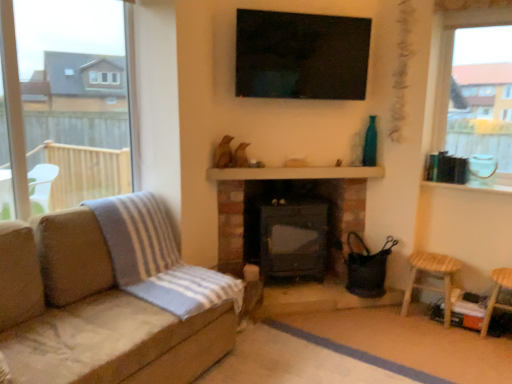
The width and height of the screenshot is (512, 384). What do you see at coordinates (294, 173) in the screenshot?
I see `wooden balustrade at center` at bounding box center [294, 173].

The width and height of the screenshot is (512, 384). In order to click on wooden stool at lower right, which is the first bar stool in left-to-right order in this screenshot , I will do `click(432, 277)`.

Looking at this image, measure the distance between point [429,266] and camera.

Point [429,266] is 9.53 feet away from camera.

What are the coordinates of `black glossy tv at upper center` in the screenshot? It's located at (301, 55).

Find the location of a particular element. The width and height of the screenshot is (512, 384). wooden stool at lower right, which ranks as the first bar stool in right-to-left order is located at coordinates (497, 295).

Where is `black matte fireplace at center`? This screenshot has width=512, height=384. black matte fireplace at center is located at coordinates (292, 205).

In the image, is clear glass window at upper right, which is counted as the 2th window, starting from the left, on the left side or the right side of black matte fireplace at center?

From the image, it's evident that clear glass window at upper right, which is counted as the 2th window, starting from the left, is to the right of black matte fireplace at center.

From a real-world perspective, does clear glass window at upper right, the first window positioned from the right, stand above black matte fireplace at center?

Yes, from a real-world perspective, clear glass window at upper right, the first window positioned from the right, is above black matte fireplace at center.

Is clear glass window at upper right, the first window positioned from the right, thinner than black matte fireplace at center?

Correct, the width of clear glass window at upper right, the first window positioned from the right, is less than that of black matte fireplace at center.

From the image's perspective, which is below, clear glass window at upper right, the first window positioned from the right, or black matte fireplace at center?

From the image's view, black matte fireplace at center is below.

Between suede couch at left and clear glass window at upper right, which is counted as the 2th window, starting from the left, which one appears on the left side from the viewer's perspective?

suede couch at left is more to the left.

From the image's perspective, is suede couch at left above clear glass window at upper right, which is counted as the 2th window, starting from the left?

No, from the image's perspective, suede couch at left is not above clear glass window at upper right, which is counted as the 2th window, starting from the left.

From a real-world perspective, starting from the suede couch at left, which window is the 2nd one vertically above it? Please provide its 2D coordinates.

[(449, 66)]

Is the position of wooden stool at lower right, which is counted as the second bar stool, starting from the right, less distant than that of transparent glass window at left, the 2th window positioned from the right?

No, it is behind transparent glass window at left, the 2th window positioned from the right.

Is wooden stool at lower right, which is the first bar stool in left-to-right order, not close to transparent glass window at left, the 2th window positioned from the right?

Yes, wooden stool at lower right, which is the first bar stool in left-to-right order, and transparent glass window at left, the 2th window positioned from the right, are quite far apart.

Considering the sizes of objects wooden stool at lower right, which is the first bar stool in left-to-right order, and transparent glass window at left, the 2th window positioned from the right, in the image provided, who is wider, wooden stool at lower right, which is the first bar stool in left-to-right order, or transparent glass window at left, the 2th window positioned from the right,?

wooden stool at lower right, which is the first bar stool in left-to-right order, is wider.

From the image's perspective, is wooden stool at lower right, which is counted as the second bar stool, starting from the right, above transparent glass window at left, marked as the first window in a left-to-right arrangement?

No.

Is wooden stool at lower right, which is counted as the second bar stool, starting from the right, oriented away from clear glass window at upper right, which is counted as the 2th window, starting from the left?

No, wooden stool at lower right, which is counted as the second bar stool, starting from the right,'s orientation is not away from clear glass window at upper right, which is counted as the 2th window, starting from the left.

Between wooden stool at lower right, which is the first bar stool in left-to-right order, and clear glass window at upper right, the first window positioned from the right, which one has smaller width?

clear glass window at upper right, the first window positioned from the right.

Consider the image. Is wooden stool at lower right, which is the first bar stool in left-to-right order, not near clear glass window at upper right, the first window positioned from the right?

That's right, there is a large distance between wooden stool at lower right, which is the first bar stool in left-to-right order, and clear glass window at upper right, the first window positioned from the right.

Which is correct: wooden stool at lower right, which is the first bar stool in left-to-right order, is inside clear glass window at upper right, which is counted as the 2th window, starting from the left, or outside of it?

wooden stool at lower right, which is the first bar stool in left-to-right order, cannot be found inside clear glass window at upper right, which is counted as the 2th window, starting from the left.

How different are the orientations of wooden stool at lower right, which is counted as the second bar stool, starting from the right, and suede couch at left in degrees?

The angle between the facing direction of wooden stool at lower right, which is counted as the second bar stool, starting from the right, and the facing direction of suede couch at left is 89.4 degrees.

From a real-world perspective, is wooden stool at lower right, which is the first bar stool in left-to-right order, on suede couch at left?

No.

Does wooden stool at lower right, which is the first bar stool in left-to-right order, have a lesser width compared to suede couch at left?

Correct, the width of wooden stool at lower right, which is the first bar stool in left-to-right order, is less than that of suede couch at left.

Is wooden stool at lower right, which is counted as the second bar stool, starting from the right, shorter than suede couch at left?

Yes, wooden stool at lower right, which is counted as the second bar stool, starting from the right, is shorter than suede couch at left.

From a real-world perspective, who is located higher, clear glass window at upper right, which is counted as the 2th window, starting from the left, or black glossy tv at upper center?

In real-world perspective, black glossy tv at upper center is above.

Measure the distance between clear glass window at upper right, the first window positioned from the right, and black glossy tv at upper center.

31.47 inches.

Which is nearer, (436, 138) or (269, 44)?

Point (436, 138) appears to be farther away from the viewer than point (269, 44).

Who is smaller, clear glass window at upper right, which is counted as the 2th window, starting from the left, or black glossy tv at upper center?

black glossy tv at upper center.

Is transparent glass window at left, the 2th window positioned from the right, not near wooden stool at lower right, which ranks as the first bar stool in right-to-left order?

Indeed, transparent glass window at left, the 2th window positioned from the right, is not near wooden stool at lower right, which ranks as the first bar stool in right-to-left order.

Based on their sizes in the image, would you say transparent glass window at left, marked as the first window in a left-to-right arrangement, is bigger or smaller than wooden stool at lower right, placed as the second bar stool when sorted from left to right?

In the image, transparent glass window at left, marked as the first window in a left-to-right arrangement, appears to be larger than wooden stool at lower right, placed as the second bar stool when sorted from left to right.

Can we say transparent glass window at left, marked as the first window in a left-to-right arrangement, lies outside wooden stool at lower right, placed as the second bar stool when sorted from left to right?

transparent glass window at left, marked as the first window in a left-to-right arrangement, lies outside wooden stool at lower right, placed as the second bar stool when sorted from left to right,'s area.

What are the coordinates of `fireplace located behind the clear glass window at upper right, which is counted as the 2th window, starting from the left` in the screenshot? It's located at (292, 205).

The image size is (512, 384). Identify the location of window to the right of suede couch at left. [449, 66].

Which object lies nearer to the anchor point black glossy tv at upper center, suede couch at left or clear glass window at upper right, which is counted as the 2th window, starting from the left?

Among the two, clear glass window at upper right, which is counted as the 2th window, starting from the left, is located nearer to black glossy tv at upper center.

Considering their positions, is wooden stool at lower right, which ranks as the first bar stool in right-to-left order, positioned closer to suede couch at left than transparent glass window at left, marked as the first window in a left-to-right arrangement?

Based on the image, wooden stool at lower right, which ranks as the first bar stool in right-to-left order, appears to be nearer to suede couch at left.

When comparing their distances from wooden stool at lower right, which is the first bar stool in left-to-right order, does transparent glass window at left, marked as the first window in a left-to-right arrangement, or black glossy tv at upper center seem further?

Among the two, transparent glass window at left, marked as the first window in a left-to-right arrangement, is located further to wooden stool at lower right, which is the first bar stool in left-to-right order.

Looking at the image, which one is located further to clear glass window at upper right, the first window positioned from the right, black glossy tv at upper center or wooden balustrade at center?

Among the two, wooden balustrade at center is located further to clear glass window at upper right, the first window positioned from the right.

Estimate the real-world distances between objects in this image. Which object is closer to black matte fireplace at center, wooden balustrade at center or suede couch at left?

wooden balustrade at center.

Estimate the real-world distances between objects in this image. Which object is closer to black matte fireplace at center, wooden balustrade at center or wooden stool at lower right, which ranks as the first bar stool in right-to-left order?

wooden balustrade at center is positioned closer to the anchor black matte fireplace at center.

Looking at the image, which one is located further to wooden stool at lower right, which is the first bar stool in left-to-right order, suede couch at left or black glossy tv at upper center?

The object further to wooden stool at lower right, which is the first bar stool in left-to-right order, is suede couch at left.

Considering their positions, is black glossy tv at upper center positioned further to wooden stool at lower right, which is counted as the second bar stool, starting from the right, than black matte fireplace at center?

The object further to wooden stool at lower right, which is counted as the second bar stool, starting from the right, is black glossy tv at upper center.

Identify the location of bar stool between wooden balustrade at center and wooden stool at lower right, which ranks as the first bar stool in right-to-left order, from left to right. The image size is (512, 384). (432, 277).

The height and width of the screenshot is (384, 512). What are the coordinates of `window screen situated between suede couch at left and wooden stool at lower right, which ranks as the first bar stool in right-to-left order, from left to right` in the screenshot? It's located at (301, 55).

I want to click on studio couch situated between transparent glass window at left, marked as the first window in a left-to-right arrangement, and black matte fireplace at center from left to right, so click(x=99, y=295).

This screenshot has width=512, height=384. Identify the location of window between suede couch at left and wooden stool at lower right, placed as the second bar stool when sorted from left to right. (449, 66).